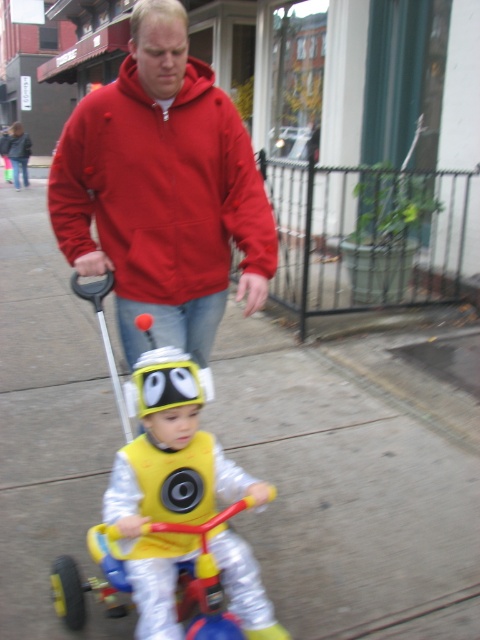
Does shiny silver costume at center have a greater width compared to yellow plastic tricycle at center?

No, shiny silver costume at center is not wider than yellow plastic tricycle at center.

Measure the distance between point (229, 586) and camera.

Point (229, 586) is 6.36 feet away from camera.

Identify the location of shiny silver costume at center. The height and width of the screenshot is (640, 480). (168, 483).

Can you confirm if matte red jacket at upper center is positioned to the right of shiny silver costume at center?

Incorrect, matte red jacket at upper center is not on the right side of shiny silver costume at center.

Is point (195, 228) more distant than point (177, 428)?

Yes.

The image size is (480, 640). I want to click on matte red jacket at upper center, so click(162, 188).

Who is more forward, (60, 358) or (59, 573)?

Point (59, 573)

Between concrete sidewalk at center and yellow plastic tricycle at center, which one is positioned lower?

Positioned lower is yellow plastic tricycle at center.

Which is behind, point (19, 419) or point (231, 515)?

Point (19, 419)

Find the location of a particular element. concrete sidewalk at center is located at coordinates (351, 481).